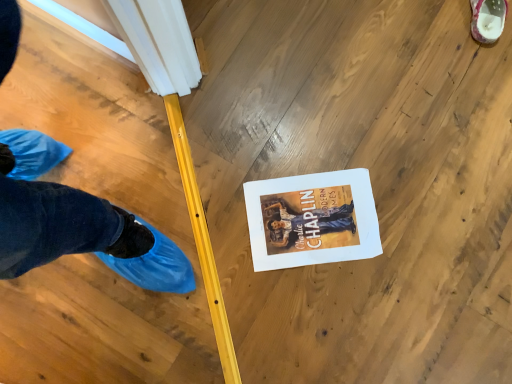
Where is `vacant area on the back side of white paper at center`? The height and width of the screenshot is (384, 512). vacant area on the back side of white paper at center is located at coordinates (307, 127).